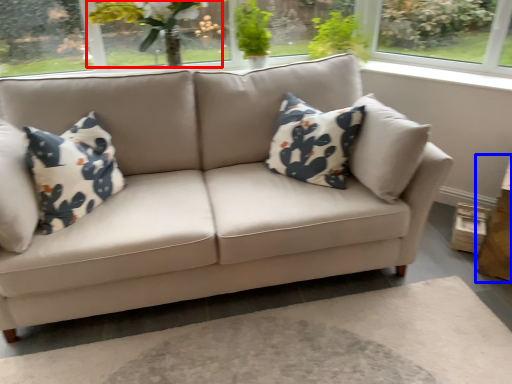
Question: Which point is further to the camera, floral arrangement (highlighted by a red box) or table (highlighted by a blue box)?

Choices:
 (A) floral arrangement
 (B) table

Answer: (A)